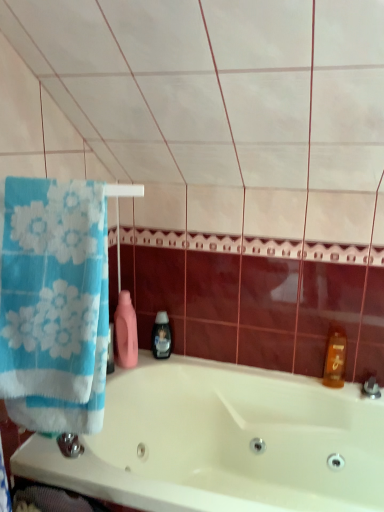
Find the location of `vacant area located to the right-hand side of black plastic soap dispenser at center`. vacant area located to the right-hand side of black plastic soap dispenser at center is located at coordinates (190, 365).